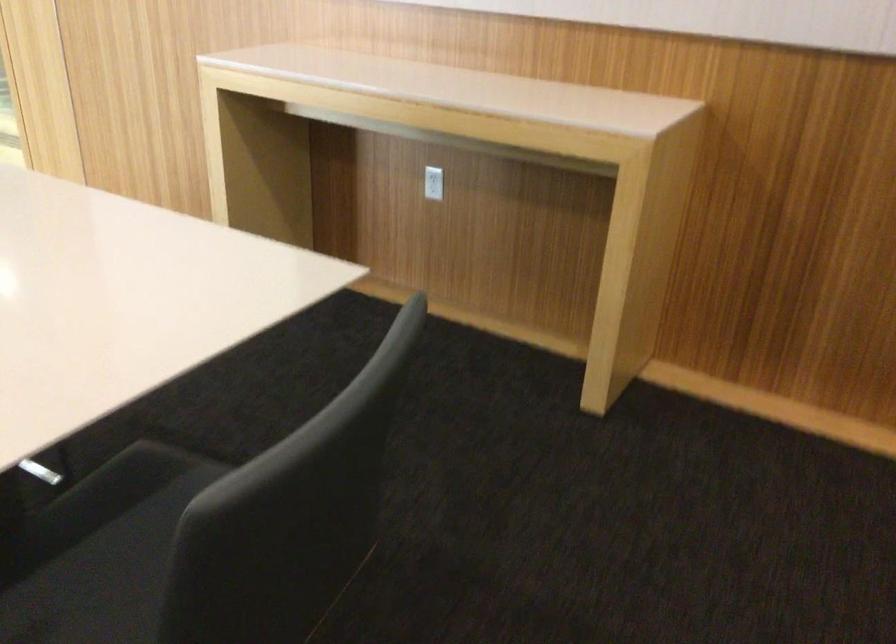
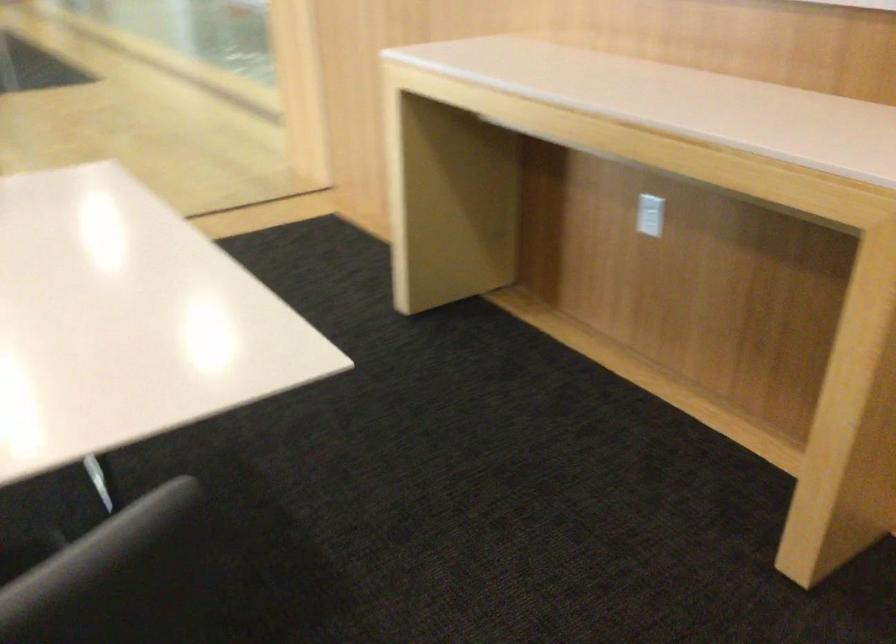
The images are taken continuously from a first-person perspective. In which direction are you moving?

The cameraman walked toward right, forward.